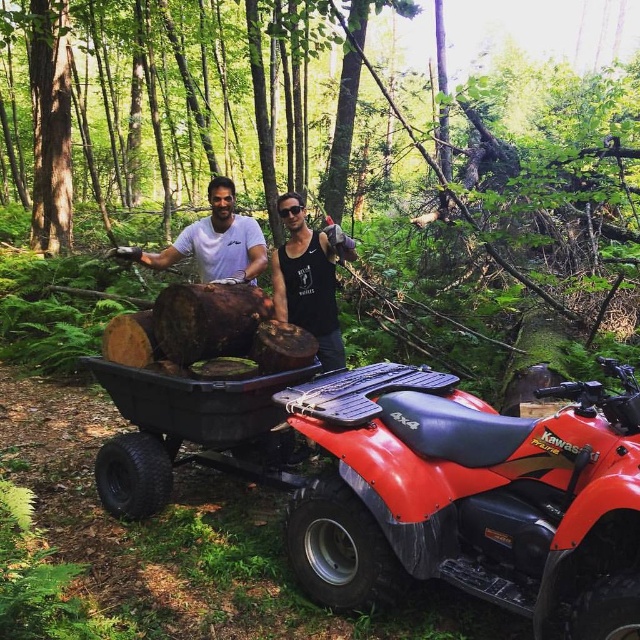
Is point (323, 358) positioned behind point (232, 196)?

That is True.

Does black matte tank top at center appear over white matte shirt at center?

No.

Find the location of `black matte tank top at center`. black matte tank top at center is located at coordinates (308, 280).

Who is more forward, (188, 387) or (234, 262)?

Point (188, 387) is in front.

Can you confirm if black plastic wagon at center is bigger than white matte shirt at center?

Yes.

Describe the element at coordinates (195, 403) in the screenshot. I see `black plastic wagon at center` at that location.

Where is `black plastic wagon at center`? The height and width of the screenshot is (640, 640). black plastic wagon at center is located at coordinates (195, 403).

Which is above, smooth wood logs at center or matte black t-shirt at center?

Positioned higher is smooth wood logs at center.

Which is behind, point (448, 240) or point (250, 236)?

The point (448, 240) is behind.

I want to click on smooth wood logs at center, so click(442, 177).